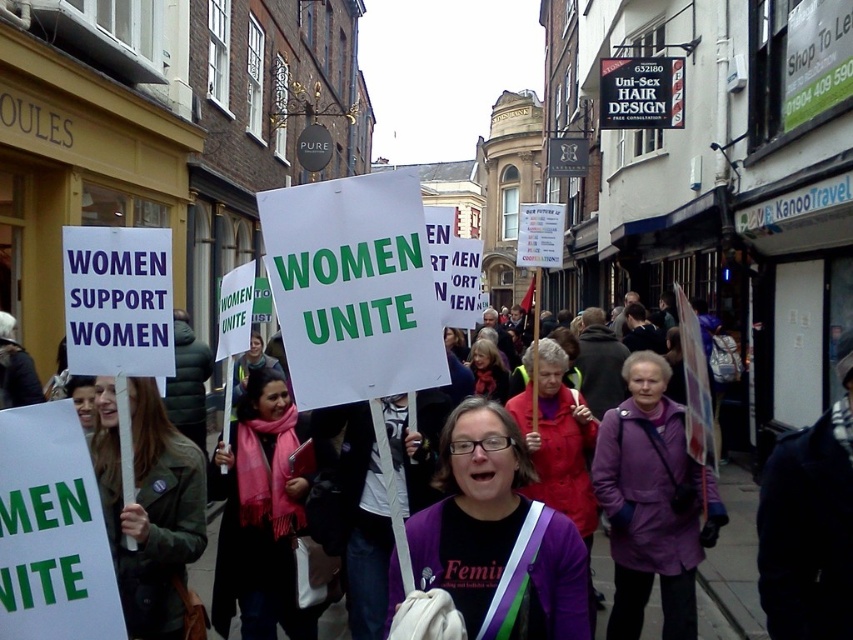
You are a photographer trying to capture a closeup of both the purple fabric at center and the pink scarf at center. Which object should you zoom in on first to ensure it fits within your camera frame?

The purple fabric at center has a smaller size compared to the pink scarf at center, so you should zoom in on the purple fabric at center first to ensure it fits within your camera frame before adjusting for the larger pink scarf at center.

You are a photographer trying to capture a clear shot of the matte pink scarf at center without the purple fabric coat at center blocking it. What should you do?

The purple fabric coat at center is in front of the matte pink scarf at center. To capture the matte pink scarf at center clearly, you should move your camera position to the side so that the purple fabric coat at center is no longer blocking the view of the matte pink scarf at center.

You are a photographer standing at the front of the protest scene. You want to take a photo that includes both the point at coordinates point (431, 568) and point (483, 349). Which point should you focus on first to ensure both are in sharp focus?

You should focus on point (431, 568) first because it is closer to you than point (483, 349), ensuring both points will be in focus when using a shallow depth of field.